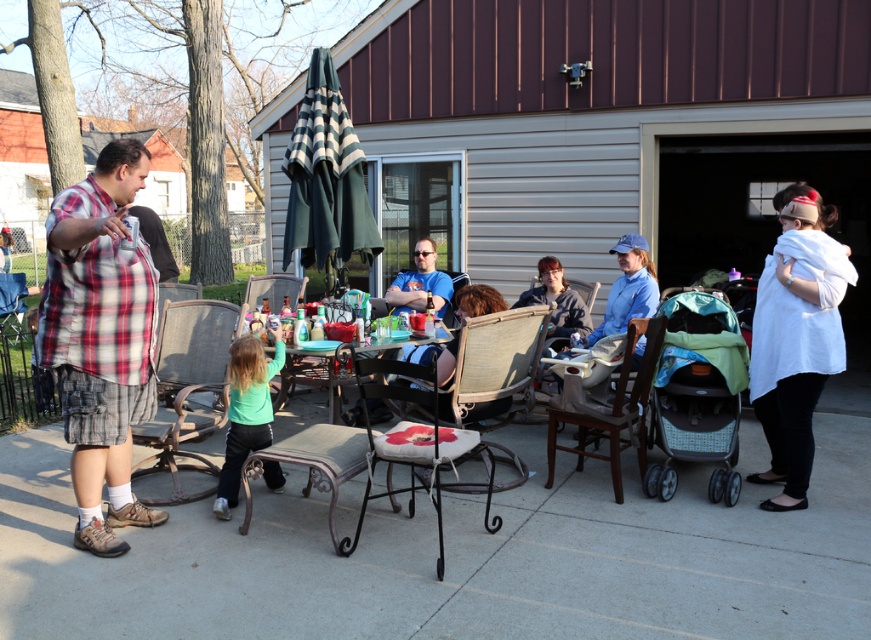
You are a delivery person carrying a large package that measures 1 meter in width. You need to navigate through the space between the white fabric cushioned chair at center and the green matte shirt at lower left to reach the doorstep. Is there enough space for you to pass through without moving any objects?

The white fabric cushioned chair at center is 1.01 meters from the green matte shirt at lower left. Since the package is 1 meter wide, there is just enough space for the package to pass through the gap between them.

You are planning to place a rectangular box that is 1.2 meters wide between the white fabric cushioned chair at center and the green matte shirt at lower left. Based on the scene description, can the box fit without overlapping either object?

The white fabric cushioned chair at center might be wider than green matte shirt at lower left, so the box with 1.2 meters width may or may not fit depending on the actual width of the chair. The description is uncertain about the exact dimensions.